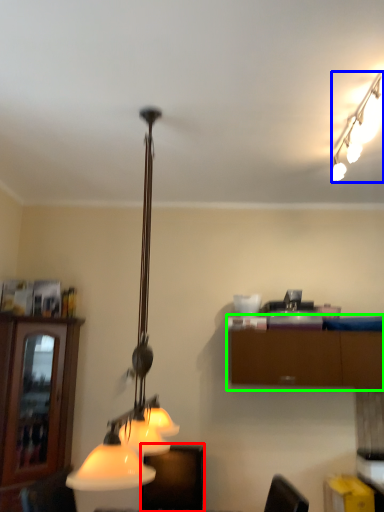
Question: Considering the real-world distances, which object is closest to furniture (highlighted by a red box)? lamp (highlighted by a blue box) or cabinetry (highlighted by a green box).

Choices:
 (A) lamp
 (B) cabinetry

Answer: (B)